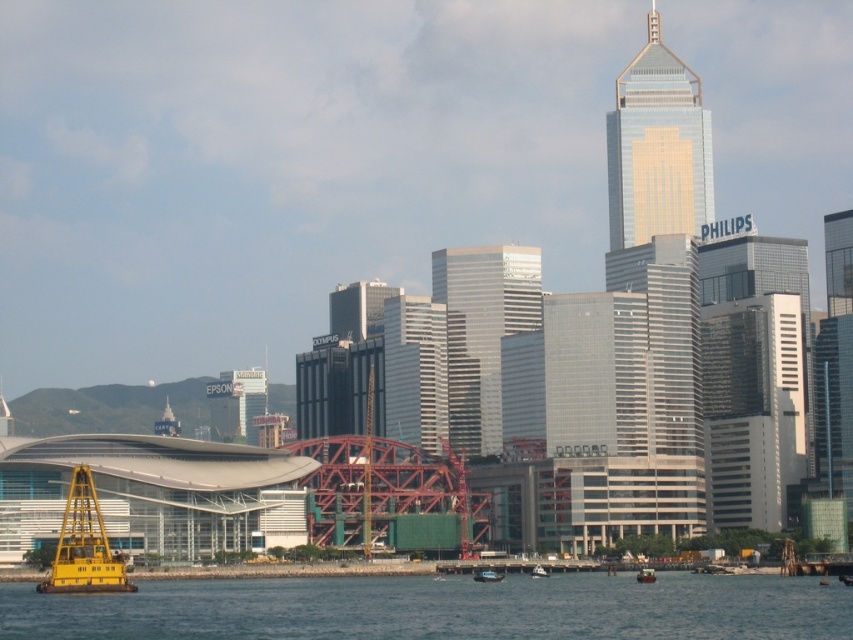
You are a drone operator tasked with delivering a package to the gold glass skyscraper at upper right. Your drone is currently at point (657, 147). Is your current position the correct location to start the delivery route to the gold glass skyscraper at upper right?

Yes, the point (657, 147) marks the gold glass skyscraper at upper right, so your current position is correct to start the delivery route to the gold glass skyscraper at upper right.

You are a surveyor standing at the point with coordinates point (84, 547). What object are you standing on?

You are standing on the yellow metallic barge at lower left.

You are a delivery drone that needs to fly from the yellow metallic barge at lower left to the metallic blue boat at center. The minimum safe distance between your drone and any object is 30 meters. Is the current distance sufficient for a safe flight?

The distance between the yellow metallic barge at lower left and the metallic blue boat at center is 58.78 meters, which is greater than the minimum safe distance of 30 meters. Therefore, the flight path is safe.